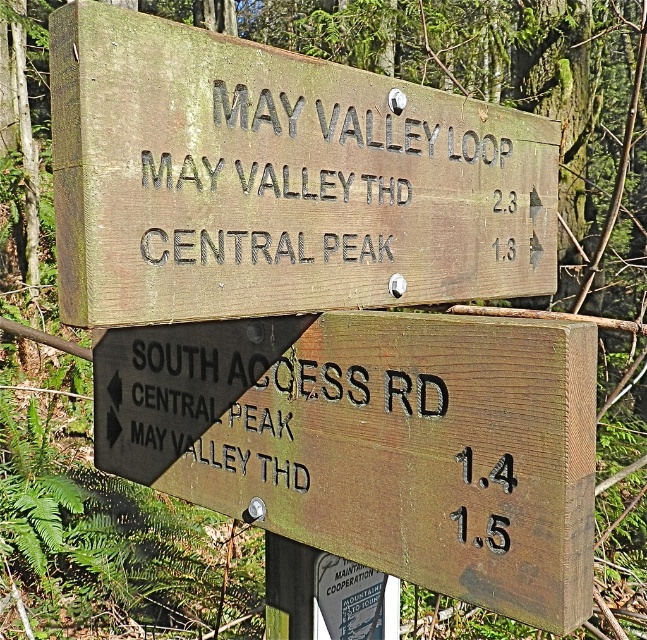
You are a hiker standing in front of two trail signs mounted on a post in a forest. You notice two points marked on the signs at coordinates point (217,285) and point (435,477). Which point is closer to you?

Point (217,285) is closer to the viewer than point (435,477).

You are standing in a forested area and see the weathered wood sign at upper center. If you want to go to the May Valley Loop, which direction should you head based on the sign?

The May Valley Loop is 2.3 miles away and the arrow on the weathered wood sign at upper center points to the right, so you should head in the direction the arrow indicates to reach it.